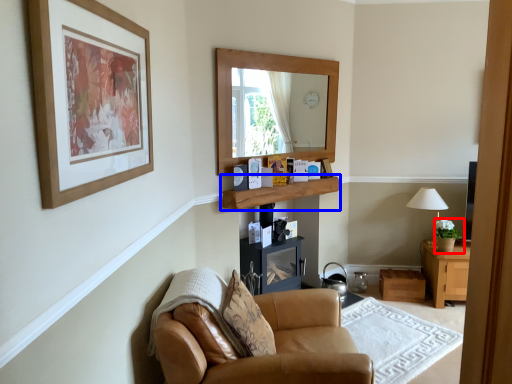
Question: Among these objects, which one is farthest to the camera, houseplant (highlighted by a red box) or shelf (highlighted by a blue box)?

Choices:
 (A) houseplant
 (B) shelf

Answer: (A)